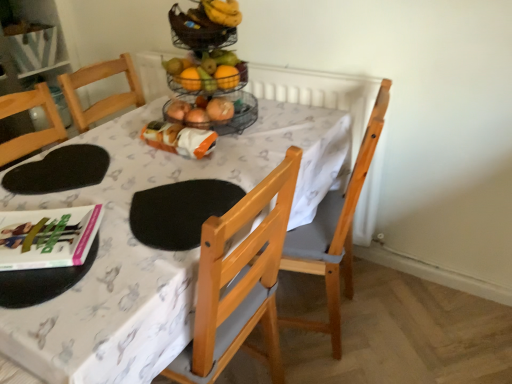
This screenshot has height=384, width=512. Find the location of `free spot to the left of orange plastic bag at center`. free spot to the left of orange plastic bag at center is located at coordinates (132, 144).